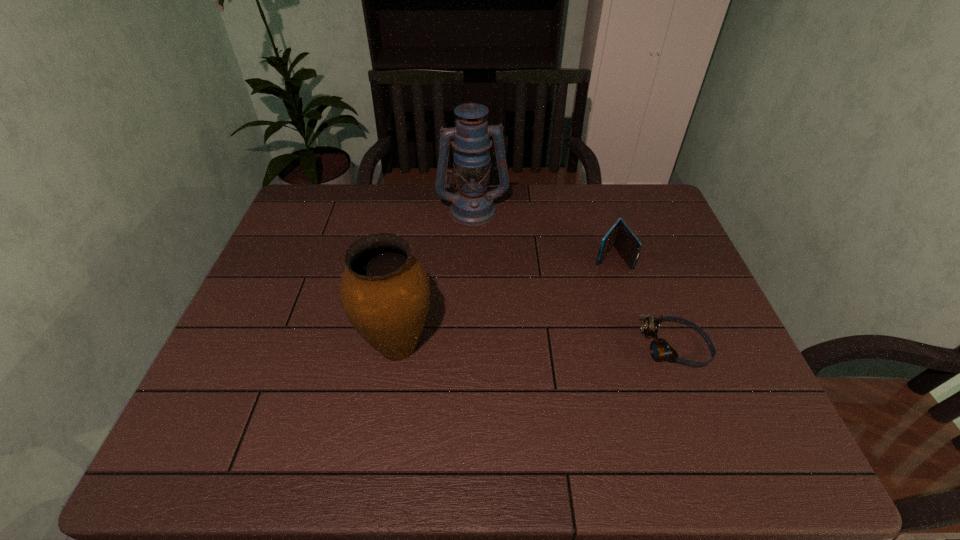
This screenshot has height=540, width=960. In order to click on the third shortest object in this screenshot , I will do `click(385, 292)`.

Where is `goggles`? goggles is located at coordinates (660, 349).

This screenshot has height=540, width=960. I want to click on the third tallest object, so click(620, 236).

Where is `wallet`? wallet is located at coordinates (620, 236).

Locate an element on the screen. lantern is located at coordinates (472, 205).

Image resolution: width=960 pixels, height=540 pixels. In order to click on the farthest object in this screenshot , I will do `click(472, 205)`.

At what (x,y) coordinates should I click in order to perform the action: click on vacant space situated 0.370m on the back of the third shortest object. Please return your answer as a coordinate pair (x, y). The width and height of the screenshot is (960, 540). Looking at the image, I should click on 417,226.

The width and height of the screenshot is (960, 540). I want to click on free space located on the exterior surface of the third nearest object, so click(557, 327).

Locate an element on the screen. The height and width of the screenshot is (540, 960). vacant space located 0.070m on the exterior surface of the third nearest object is located at coordinates (592, 282).

I want to click on vacant point located 0.380m on the exterior surface of the third nearest object, so click(535, 357).